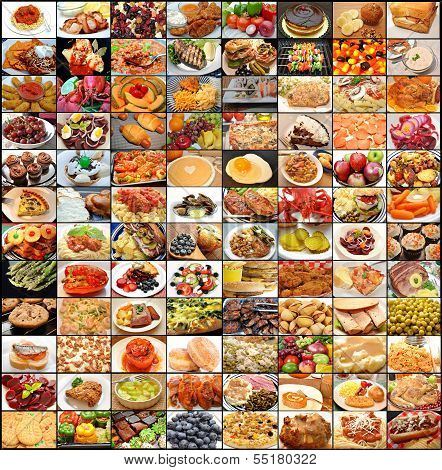
This screenshot has width=442, height=470. What are the coordinates of `bowls` in the screenshot? It's located at (145, 401), (413, 70), (63, 12), (173, 24), (49, 136), (73, 180), (284, 279).